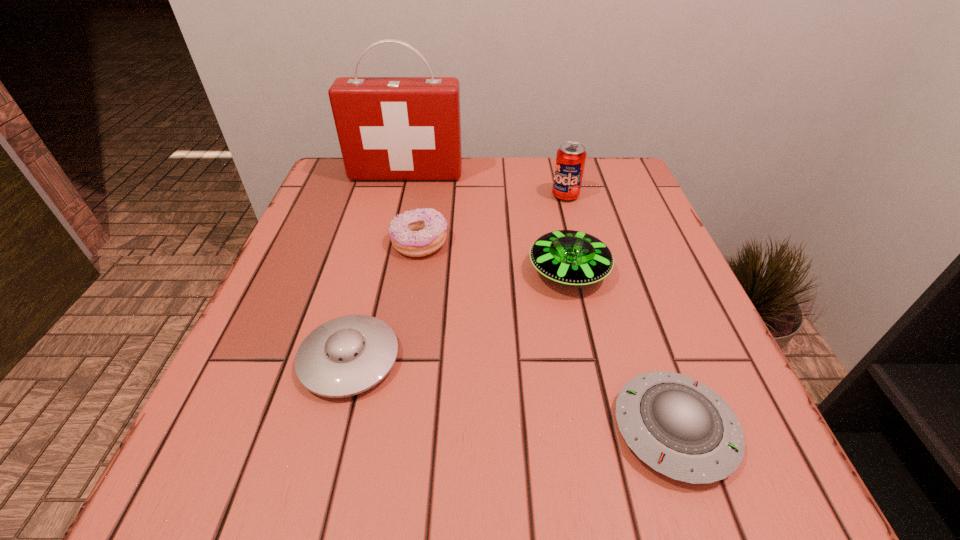
This screenshot has height=540, width=960. I want to click on object that is at the far right corner, so click(570, 160).

I want to click on object situated at the near right corner, so click(681, 428).

The height and width of the screenshot is (540, 960). I want to click on blank area at the far edge, so click(x=466, y=163).

In the image, there is a desktop. Identify the location of vacant region at the near edge. (397, 450).

You are a GUI agent. You are given a task and a screenshot of the screen. Output one action in this format:
    pyautogui.click(x=<x>, y=<y>)
    Task: Click on the free space at the left edge of the desktop
    The width and height of the screenshot is (960, 540).
    Given the screenshot: What is the action you would take?
    pyautogui.click(x=272, y=343)

Find the location of `vacant space at the right edge of the desktop`. vacant space at the right edge of the desktop is located at coordinates (725, 389).

This screenshot has height=540, width=960. I want to click on vacant space at the far left corner, so click(x=370, y=193).

Locate an element on the screen. Image resolution: width=960 pixels, height=540 pixels. vacant space at the near left corner is located at coordinates (279, 441).

Where is `free space at the far right corner of the desktop`? The height and width of the screenshot is (540, 960). free space at the far right corner of the desktop is located at coordinates (585, 179).

The width and height of the screenshot is (960, 540). In the image, there is a desktop. In order to click on vacant space at the near right corner in this screenshot , I will do `click(748, 501)`.